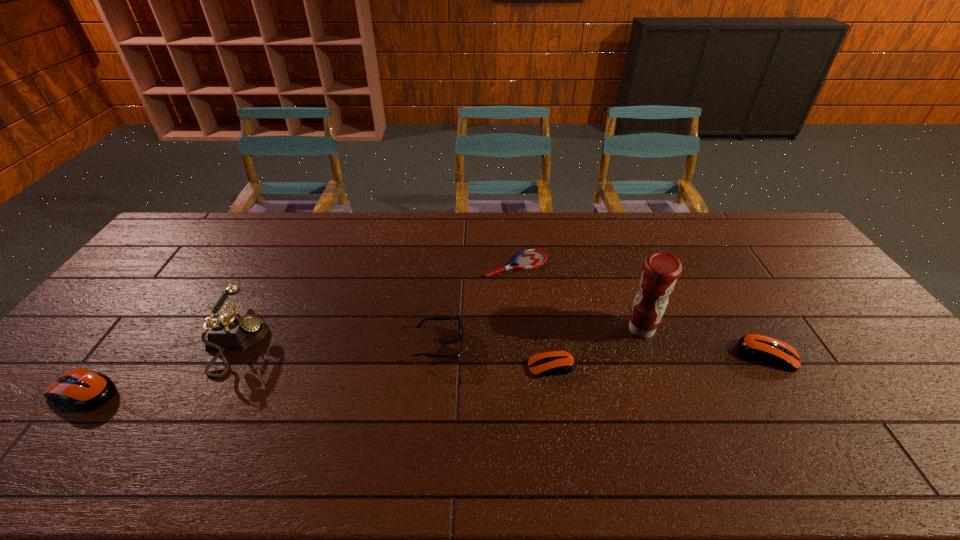
The width and height of the screenshot is (960, 540). In order to click on vacant space that satisfies the following two spatial constraints: 1. on the dial of the second tallest object; 2. on the right side of the rightmost object in this screenshot , I will do `click(229, 355)`.

What are the coordinates of `blank space that satisfies the following two spatial constraints: 1. on the back side of the leftmost computer mouse; 2. on the right side of the sixth tallest object` in the screenshot? It's located at (104, 367).

Where is `vacant space that satisfies the following two spatial constraints: 1. on the dial of the second shortest computer mouse; 2. on the right side of the second tallest object`? vacant space that satisfies the following two spatial constraints: 1. on the dial of the second shortest computer mouse; 2. on the right side of the second tallest object is located at coordinates (229, 355).

Find the location of a particular element. The image size is (960, 540). vacant area in the image that satisfies the following two spatial constraints: 1. on the dial of the second object from left to right; 2. on the back side of the second tallest computer mouse is located at coordinates (229, 355).